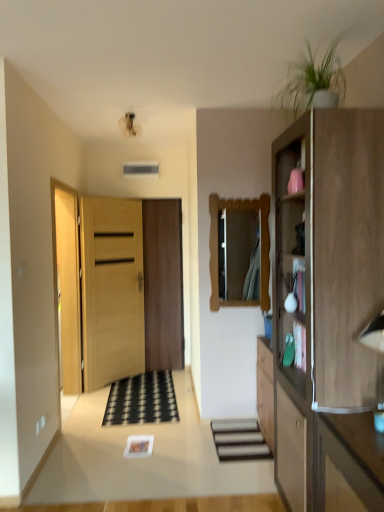
The height and width of the screenshot is (512, 384). Find the location of `free area below wooden mirror at center (from a real-world perspective)`. free area below wooden mirror at center (from a real-world perspective) is located at coordinates (237, 419).